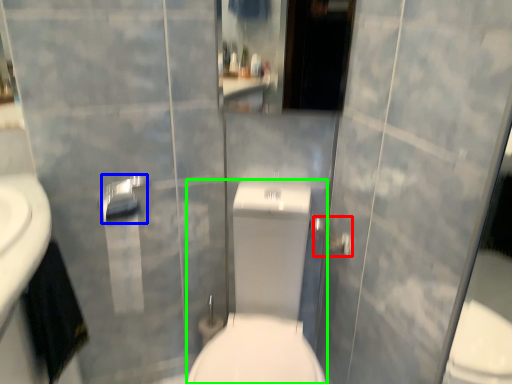
Question: Which object is positioned farthest from shower (highlighted by a red box)? Select from towel bar (highlighted by a blue box) and sit (highlighted by a green box).

Choices:
 (A) towel bar
 (B) sit

Answer: (A)